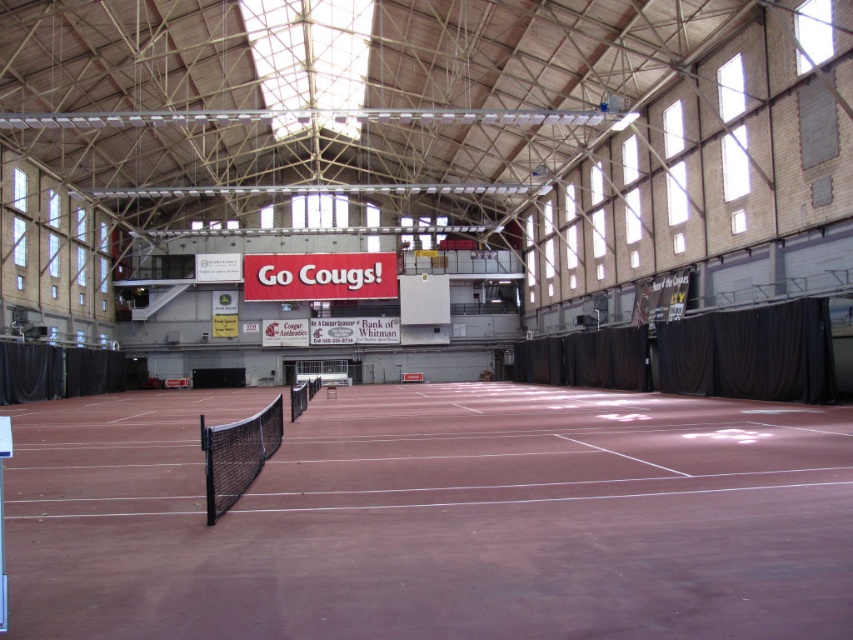
Question: Can you confirm if brown clay tennis court at center is wider than black mesh net at center?

Choices:
 (A) no
 (B) yes

Answer: (B)

Question: Is brown clay tennis court at center positioned behind black mesh net at center?

Choices:
 (A) yes
 (B) no

Answer: (B)

Question: Is brown clay tennis court at center positioned in front of black mesh net at center?

Choices:
 (A) no
 (B) yes

Answer: (B)

Question: Among these objects, which one is nearest to the camera?

Choices:
 (A) brown clay tennis court at center
 (B) black mesh net at center

Answer: (A)